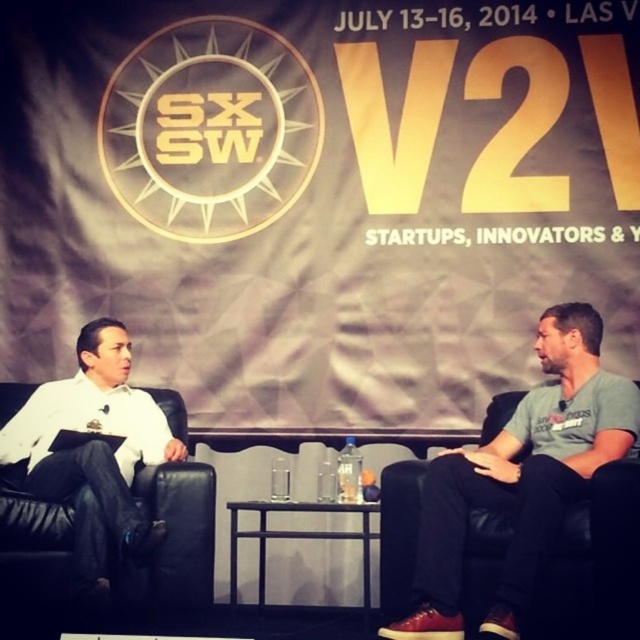
Question: Can you confirm if gray cotton t-shirt at right is thinner than white matte shirt at left?

Choices:
 (A) no
 (B) yes

Answer: (A)

Question: In this image, where is gray cotton t-shirt at right located relative to white matte shirt at left?

Choices:
 (A) above
 (B) below

Answer: (B)

Question: From the image, what is the correct spatial relationship of gray cotton t-shirt at right in relation to white matte shirt at left?

Choices:
 (A) above
 (B) below

Answer: (B)

Question: Which of the following is the closest to the observer?

Choices:
 (A) white matte shirt at left
 (B) gray cotton t-shirt at right

Answer: (B)

Question: Which point is closer to the camera taking this photo?

Choices:
 (A) (49, 490)
 (B) (435, 516)

Answer: (B)

Question: Which point is closer to the camera?

Choices:
 (A) (529, 600)
 (B) (12, 419)

Answer: (A)